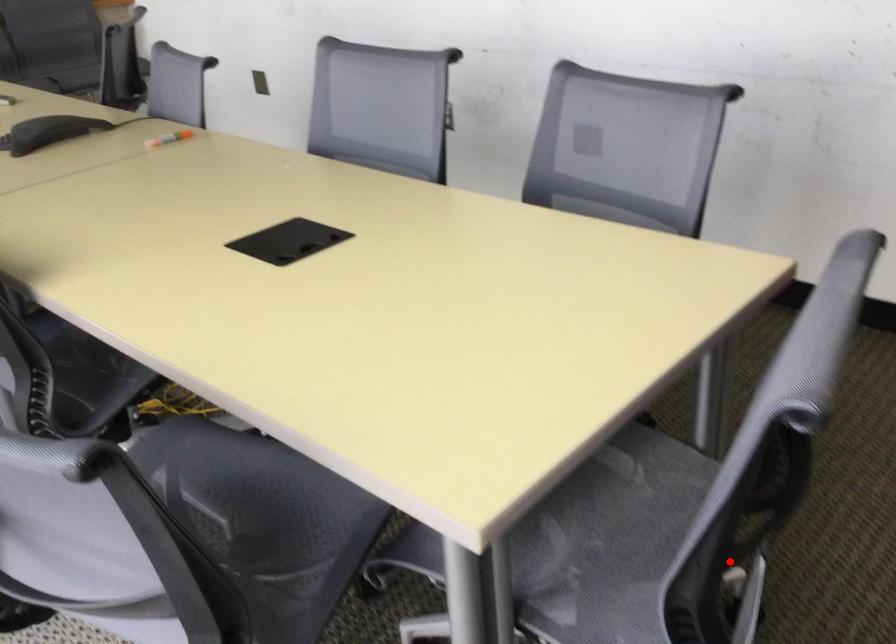
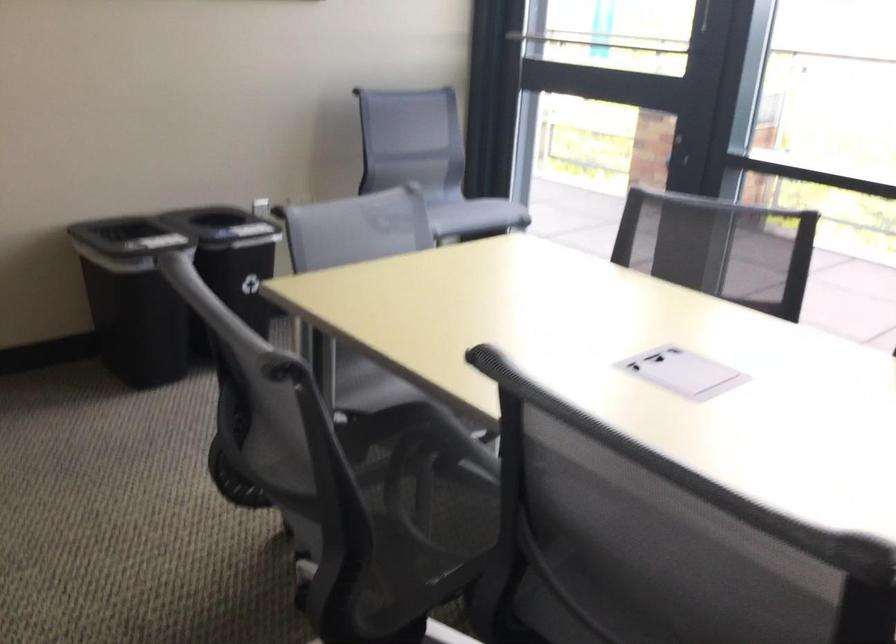
Question: A red point is marked in image1. In image2, is the corresponding 3D point closer to the camera or farther? Reply with the corresponding letter.

Choices:
 (A) The corresponding 3D point is closer.
 (B) The corresponding 3D point is farther.

Answer: (B)